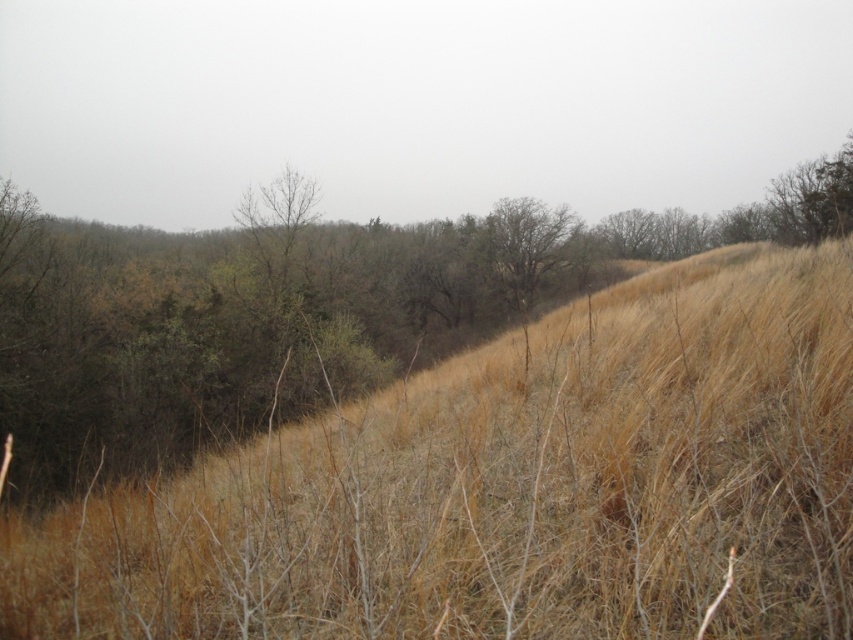
From the picture: You are standing in the middle of the dry grass at center and looking towards the bare wood tree at center. Which object is taller from your perspective?

The bare wood tree at center is taller than the dry grass at center.

You are standing in the natural landscape described. You see two points marked as point (787, 397) and point (543, 209). Which point is closer to you?

Point (787, 397) is closer to you because it is in front of point (543, 209).